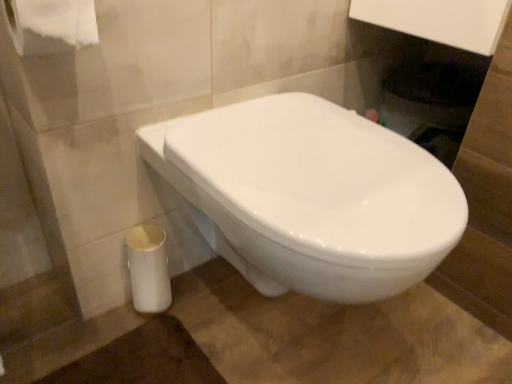
Question: Is the depth of white glossy toilet at center greater than that of white paper at upper left?

Choices:
 (A) no
 (B) yes

Answer: (A)

Question: From a real-world perspective, does white glossy toilet at center stand above white paper at upper left?

Choices:
 (A) no
 (B) yes

Answer: (A)

Question: Is white glossy toilet at center at the left side of white paper at upper left?

Choices:
 (A) yes
 (B) no

Answer: (B)

Question: From the image's perspective, is white glossy toilet at center under white paper at upper left?

Choices:
 (A) yes
 (B) no

Answer: (A)

Question: Would you say white glossy toilet at center is outside white paper at upper left?

Choices:
 (A) no
 (B) yes

Answer: (B)

Question: Is white glossy toilet at center surrounding white paper at upper left?

Choices:
 (A) yes
 (B) no

Answer: (B)

Question: From the image's perspective, is white glossy trash can at lower left located above white paper at upper left?

Choices:
 (A) yes
 (B) no

Answer: (B)

Question: Is white glossy trash can at lower left taller than white paper at upper left?

Choices:
 (A) no
 (B) yes

Answer: (B)

Question: Does white glossy trash can at lower left have a greater width compared to white paper at upper left?

Choices:
 (A) no
 (B) yes

Answer: (A)

Question: Is white glossy trash can at lower left closer to the viewer compared to white paper at upper left?

Choices:
 (A) no
 (B) yes

Answer: (A)

Question: From the image's perspective, is white glossy trash can at lower left under white paper at upper left?

Choices:
 (A) no
 (B) yes

Answer: (B)

Question: Is white glossy trash can at lower left located outside white paper at upper left?

Choices:
 (A) yes
 (B) no

Answer: (A)

Question: Is white glossy trash can at lower left facing towards white glossy toilet at center?

Choices:
 (A) yes
 (B) no

Answer: (A)